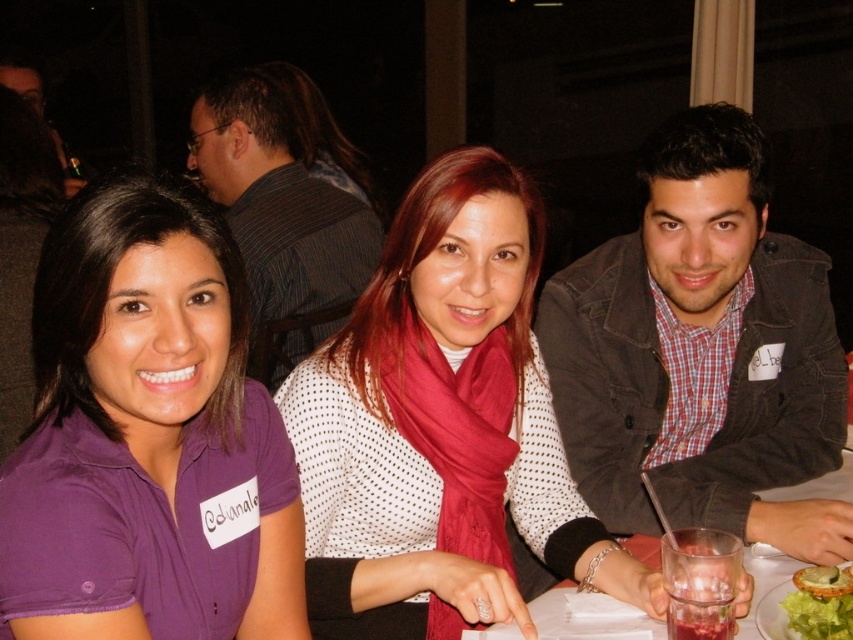
Between dark gray jacket at right and striped shirt at center, which one has less height?

dark gray jacket at right

Is dark gray jacket at right thinner than striped shirt at center?

Correct, dark gray jacket at right's width is less than striped shirt at center's.

The image size is (853, 640). Identify the location of dark gray jacket at right. (701, 353).

Find the location of a particular element. dark gray jacket at right is located at coordinates (701, 353).

Can you confirm if purple cotton shirt at left is positioned to the right of striped shirt at center?

Yes, purple cotton shirt at left is to the right of striped shirt at center.

Between purple cotton shirt at left and striped shirt at center, which one is positioned higher?

striped shirt at center is higher up.

This screenshot has height=640, width=853. What do you see at coordinates (148, 438) in the screenshot?
I see `purple cotton shirt at left` at bounding box center [148, 438].

Locate an element on the screen. The height and width of the screenshot is (640, 853). purple cotton shirt at left is located at coordinates (148, 438).

Who is positioned more to the right, purple cotton shirt at left or clear glass at center?

clear glass at center is more to the right.

The width and height of the screenshot is (853, 640). In order to click on purple cotton shirt at left in this screenshot , I will do `click(148, 438)`.